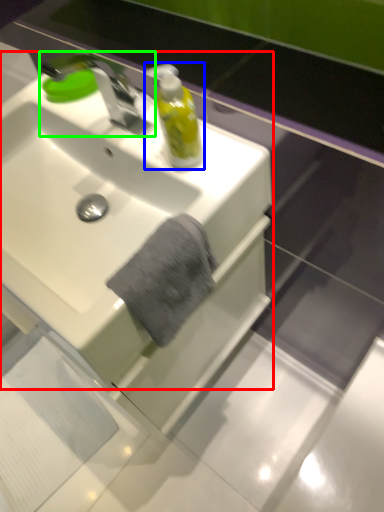
Question: Which is farther away from sink (highlighted by a red box)? mouthwash (highlighted by a blue box) or tap (highlighted by a green box)?

Choices:
 (A) mouthwash
 (B) tap

Answer: (A)